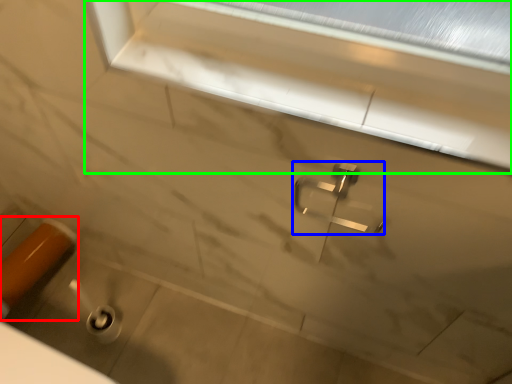
Question: Which object is the farthest from door handle (highlighted by a red box)? Choose among these: tap (highlighted by a blue box) or window frame (highlighted by a green box).

Choices:
 (A) tap
 (B) window frame

Answer: (B)